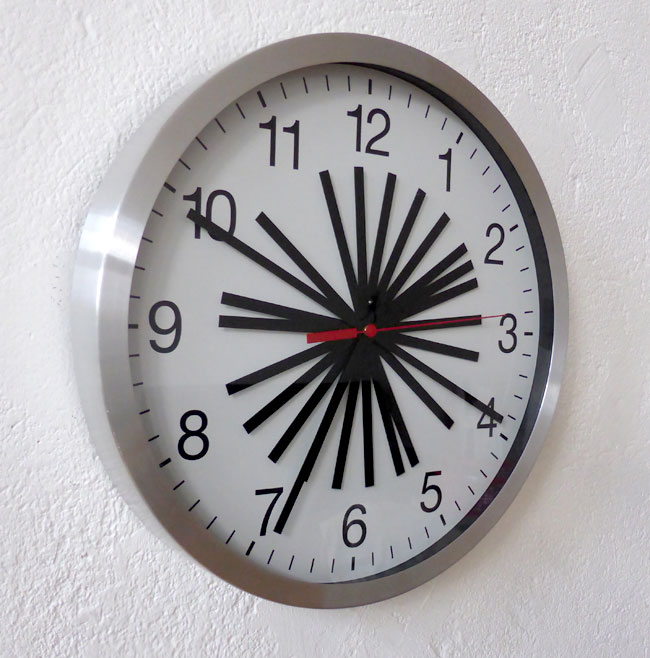
Find the location of a particular element. clock is located at coordinates (387, 505).